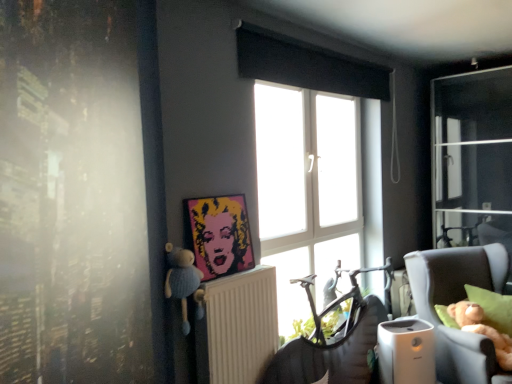
Question: From a real-world perspective, is beige fabric chair at right physically located above or below pop art portrait at center?

Choices:
 (A) above
 (B) below

Answer: (B)

Question: Visually, is beige fabric chair at right positioned to the left or to the right of pop art portrait at center?

Choices:
 (A) left
 (B) right

Answer: (B)

Question: Which object is positioned farthest from the white plastic radiator at center?

Choices:
 (A) beige fabric chair at right
 (B) metallic silver swivel chair at center
 (C) plush blue bear at left
 (D) pop art portrait at center
 (E) white glass window at center

Answer: (A)

Question: Estimate the real-world distances between objects in this image. Which object is closer to the metallic silver swivel chair at center?

Choices:
 (A) white glass window at center
 (B) plush blue bear at left
 (C) white plastic radiator at center
 (D) beige fabric chair at right
 (E) pop art portrait at center

Answer: (C)